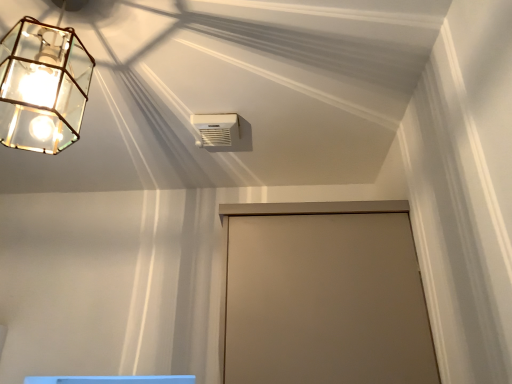
Question: Does beige matte door at center come in front of white plastic air conditioning unit at upper center?

Choices:
 (A) yes
 (B) no

Answer: (A)

Question: Can you confirm if beige matte door at center is positioned to the right of white plastic air conditioning unit at upper center?

Choices:
 (A) yes
 (B) no

Answer: (A)

Question: Are beige matte door at center and white plastic air conditioning unit at upper center beside each other?

Choices:
 (A) yes
 (B) no

Answer: (B)

Question: From the image's perspective, is beige matte door at center above white plastic air conditioning unit at upper center?

Choices:
 (A) yes
 (B) no

Answer: (B)

Question: From the image's perspective, is beige matte door at center below white plastic air conditioning unit at upper center?

Choices:
 (A) yes
 (B) no

Answer: (A)

Question: Is point (45, 102) closer or farther from the camera than point (233, 125)?

Choices:
 (A) farther
 (B) closer

Answer: (B)

Question: From the image's perspective, is clear glass lantern at upper left positioned above or below white plastic air conditioning unit at upper center?

Choices:
 (A) above
 (B) below

Answer: (A)

Question: Choose the correct answer: Is clear glass lantern at upper left inside white plastic air conditioning unit at upper center or outside it?

Choices:
 (A) outside
 (B) inside

Answer: (A)

Question: From a real-world perspective, is clear glass lantern at upper left above or below white plastic air conditioning unit at upper center?

Choices:
 (A) above
 (B) below

Answer: (B)

Question: From a real-world perspective, is beige matte door at center physically located above or below white plastic air conditioning unit at upper center?

Choices:
 (A) below
 (B) above

Answer: (A)

Question: Is beige matte door at center to the left or to the right of white plastic air conditioning unit at upper center in the image?

Choices:
 (A) right
 (B) left

Answer: (A)

Question: In terms of width, does beige matte door at center look wider or thinner when compared to white plastic air conditioning unit at upper center?

Choices:
 (A) thin
 (B) wide

Answer: (B)

Question: From the image's perspective, relative to white plastic air conditioning unit at upper center, is beige matte door at center above or below?

Choices:
 (A) above
 (B) below

Answer: (B)

Question: In the image, is white plastic air conditioning unit at upper center positioned in front of or behind clear glass lantern at upper left?

Choices:
 (A) front
 (B) behind

Answer: (B)

Question: Looking at their shapes, would you say white plastic air conditioning unit at upper center is wider or thinner than clear glass lantern at upper left?

Choices:
 (A) thin
 (B) wide

Answer: (A)